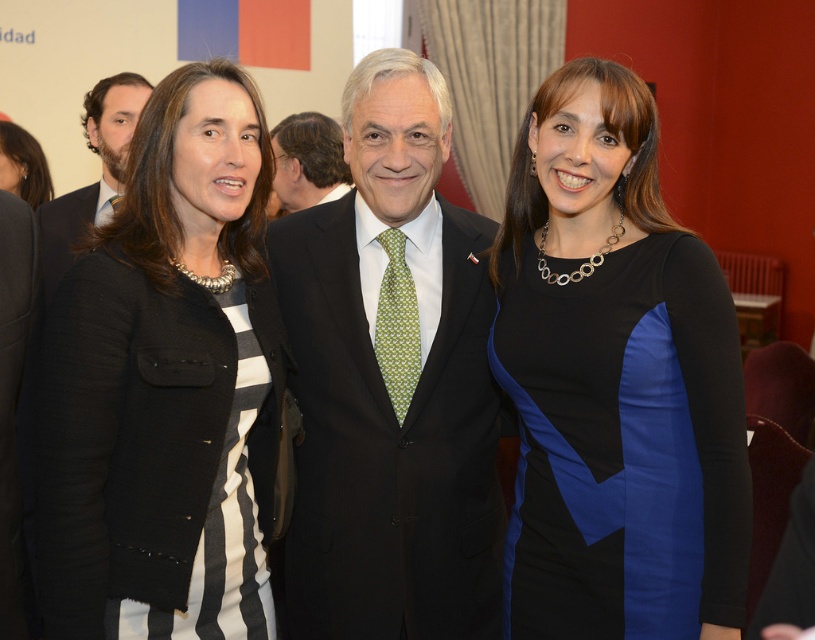
Question: Which of the following is the farthest from the observer?

Choices:
 (A) (372, 138)
 (B) (672, 332)
 (C) (390, 294)
 (D) (347, 182)

Answer: (D)

Question: Which point appears farthest from the camera in this image?

Choices:
 (A) (95, 90)
 (B) (320, 124)

Answer: (B)

Question: Does black textured blazer at left appear over matte black suit at left?

Choices:
 (A) no
 (B) yes

Answer: (A)

Question: Can you confirm if matte black suit at left is positioned to the left of matte black jacket at upper left?

Choices:
 (A) no
 (B) yes

Answer: (A)

Question: Which point is closer to the camera taking this photo?

Choices:
 (A) (393, 301)
 (B) (380, 410)
 (C) (68, 445)
 (D) (285, 122)

Answer: (C)

Question: Is green woven tie at center bigger than green textured tie at center?

Choices:
 (A) no
 (B) yes

Answer: (A)